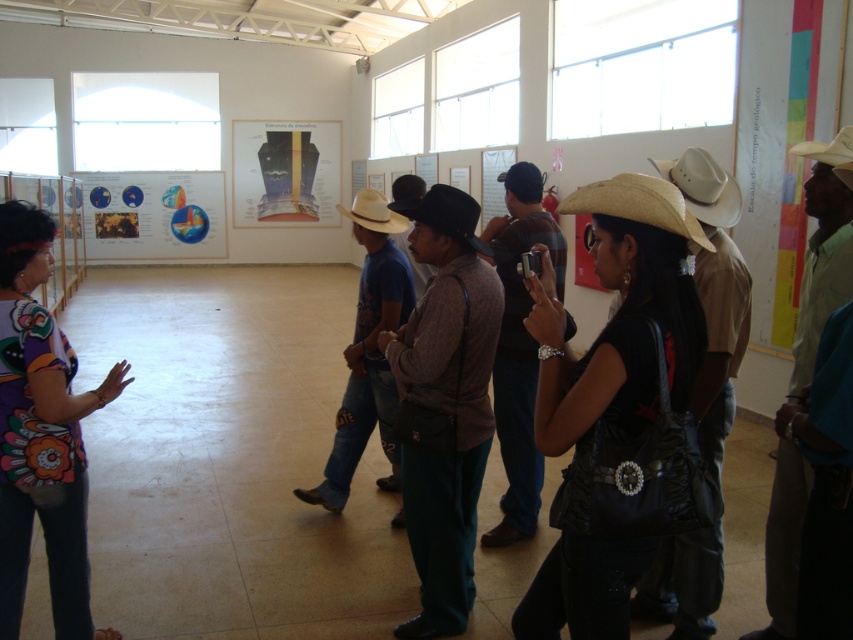
Between point (607, 209) and point (791, 148), which one is positioned behind?

The point (791, 148) is more distant.

Is natural straw cowboy hat at center to the left of white matte cowboy hat at upper right from the viewer's perspective?

Yes, natural straw cowboy hat at center is to the left of white matte cowboy hat at upper right.

Image resolution: width=853 pixels, height=640 pixels. Describe the element at coordinates (637, 204) in the screenshot. I see `natural straw cowboy hat at center` at that location.

This screenshot has width=853, height=640. In order to click on natural straw cowboy hat at center in this screenshot , I will do `click(637, 204)`.

Looking at this image, who is positioned more to the left, printed fabric blouse at left or natural straw cowboy hat at center?

Positioned to the left is printed fabric blouse at left.

Is printed fabric blouse at left to the right of natural straw cowboy hat at center from the viewer's perspective?

Incorrect, printed fabric blouse at left is not on the right side of natural straw cowboy hat at center.

Measure the distance between printed fabric blouse at left and camera.

printed fabric blouse at left is 2.58 meters from camera.

Locate an element on the screen. This screenshot has height=640, width=853. printed fabric blouse at left is located at coordinates (41, 435).

Is point (405, 218) in front of point (840, 161)?

That is False.

Which of these two, light brown straw cowboy hat at center or white matte cowboy hat at upper right, stands shorter?

white matte cowboy hat at upper right

Is point (364, 221) closer to camera compared to point (828, 154)?

No, it is not.

Identify the location of light brown straw cowboy hat at center. The image size is (853, 640). (374, 212).